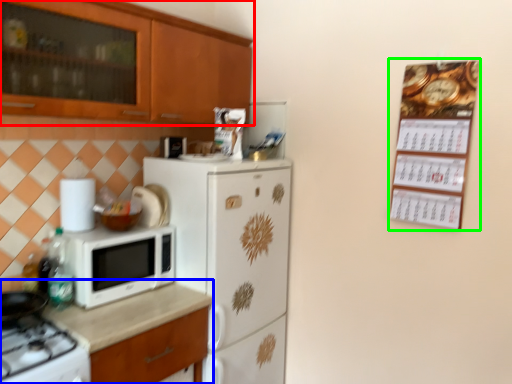
Question: Based on their relative distances, which object is nearer to cabinetry (highlighted by a red box)? Choose from countertop (highlighted by a blue box) and bulletin board (highlighted by a green box).

Choices:
 (A) countertop
 (B) bulletin board

Answer: (A)